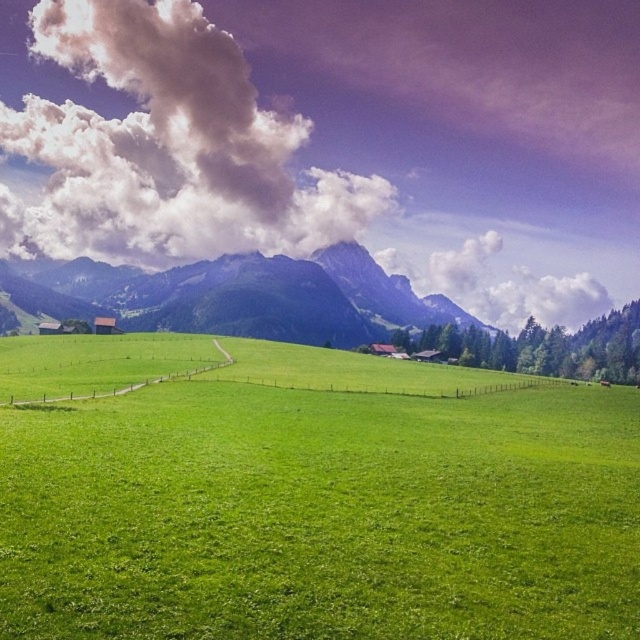
You are a bird soaring above the pastoral landscape. You notice the green grassy field at center and the white fluffy cloud at upper center. Which object appears smaller in the sky?

The green grassy field at center appears smaller compared to the white fluffy cloud at upper center in the sky.

You are a drone operator who needs to fly a drone from the green grassy field at center to the white fluffy cloud at upper center. Given that your drone has a maximum flight range of 2000 feet, can it reach the cloud?

The distance between the green grassy field at center and the white fluffy cloud at upper center is 2187.88 feet. Since the drone can only fly up to 2000 feet, it cannot reach the cloud.